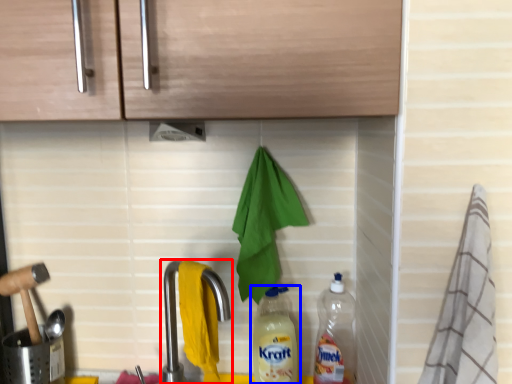
Question: Which object is closer to the camera taking this photo, tap (highlighted by a red box) or bottle (highlighted by a blue box)?

Choices:
 (A) tap
 (B) bottle

Answer: (A)